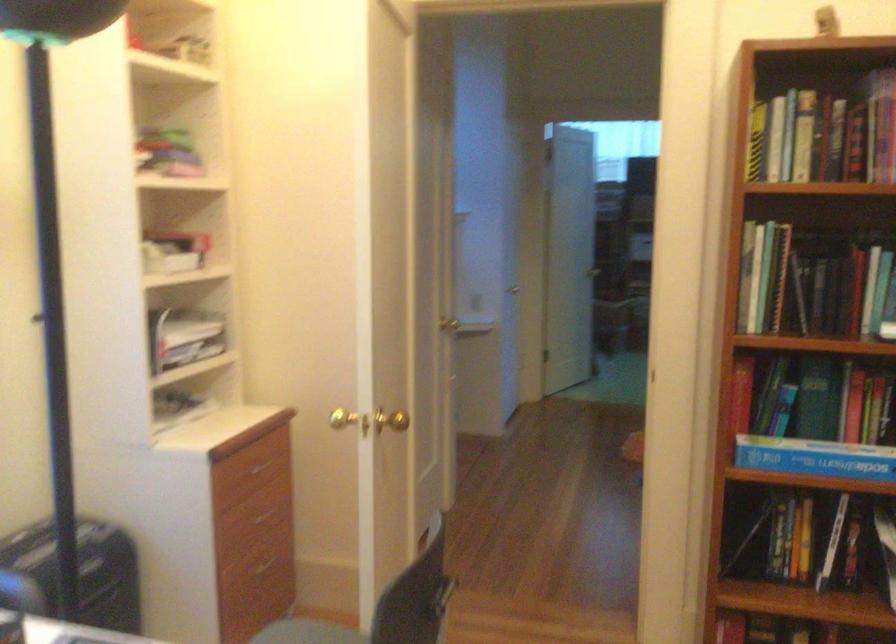
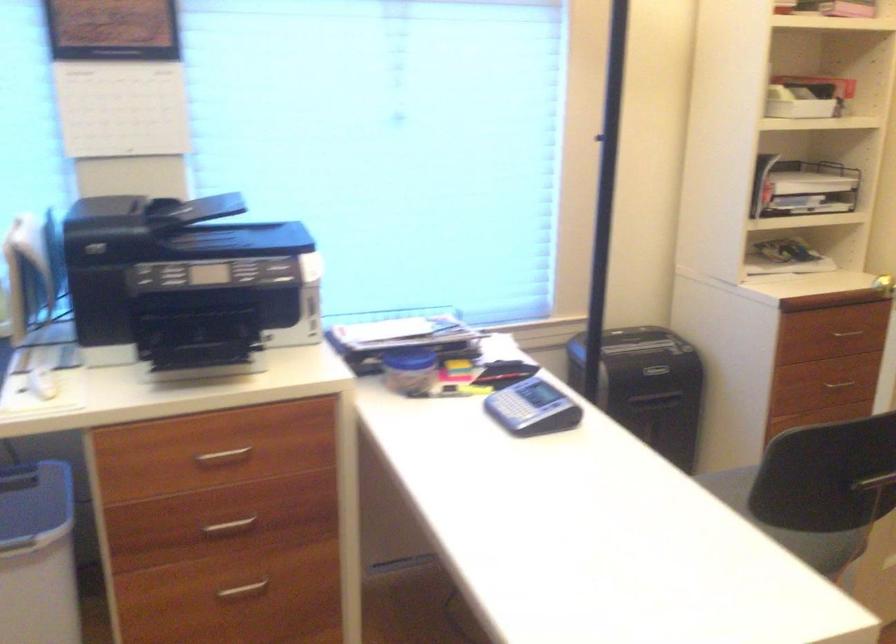
Find the pixel in the second image that matches [264,524] in the first image.

(838, 384)